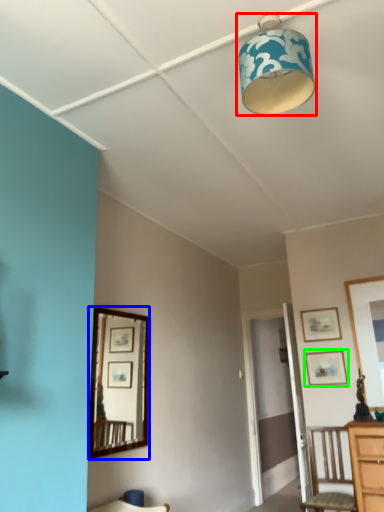
Question: Which is nearer to the lamp (highlighted by a red box)? mirror (highlighted by a blue box) or picture frame (highlighted by a green box).

Choices:
 (A) mirror
 (B) picture frame

Answer: (B)